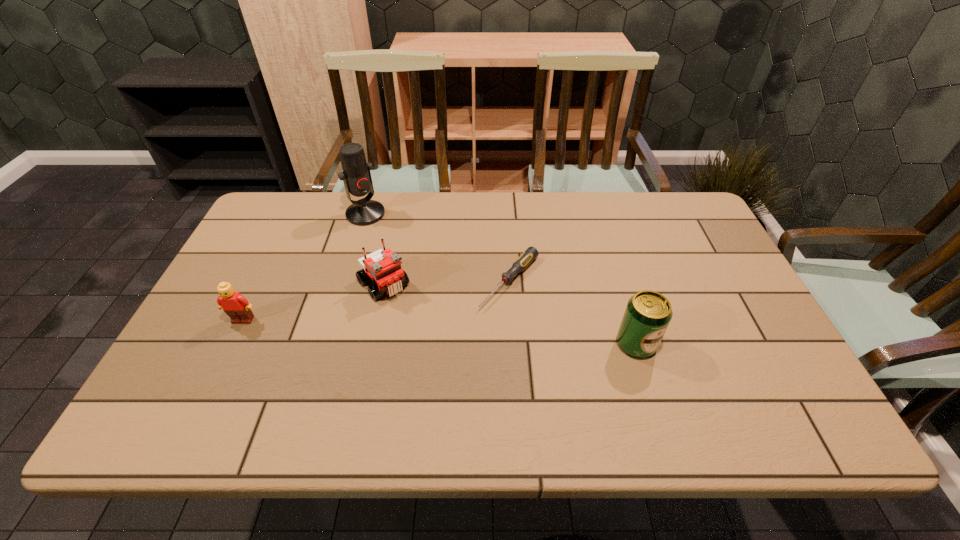
Image resolution: width=960 pixels, height=540 pixels. I want to click on object present at the far edge, so click(x=356, y=175).

The image size is (960, 540). In order to click on object that is at the left edge in this screenshot , I will do `click(236, 306)`.

The height and width of the screenshot is (540, 960). In the image, there is a desktop. In order to click on vacant space at the far edge in this screenshot , I will do `click(534, 208)`.

The height and width of the screenshot is (540, 960). In order to click on vacant space at the near edge of the desktop in this screenshot , I will do `click(263, 389)`.

The height and width of the screenshot is (540, 960). In the image, there is a desktop. Identify the location of free region at the left edge. (234, 282).

Image resolution: width=960 pixels, height=540 pixels. In order to click on vacant space at the right edge of the desktop in this screenshot , I will do `click(698, 279)`.

Find the location of a particular element. This screenshot has height=540, width=960. vacant area at the near left corner is located at coordinates (178, 392).

Where is `free space that is in between the left Lego and the right Lego`? Image resolution: width=960 pixels, height=540 pixels. free space that is in between the left Lego and the right Lego is located at coordinates (313, 302).

The height and width of the screenshot is (540, 960). In order to click on unoccupied area between the right Lego and the screwdriver in this screenshot , I will do `click(446, 282)`.

I want to click on free space between the shortest object and the microphone, so click(438, 247).